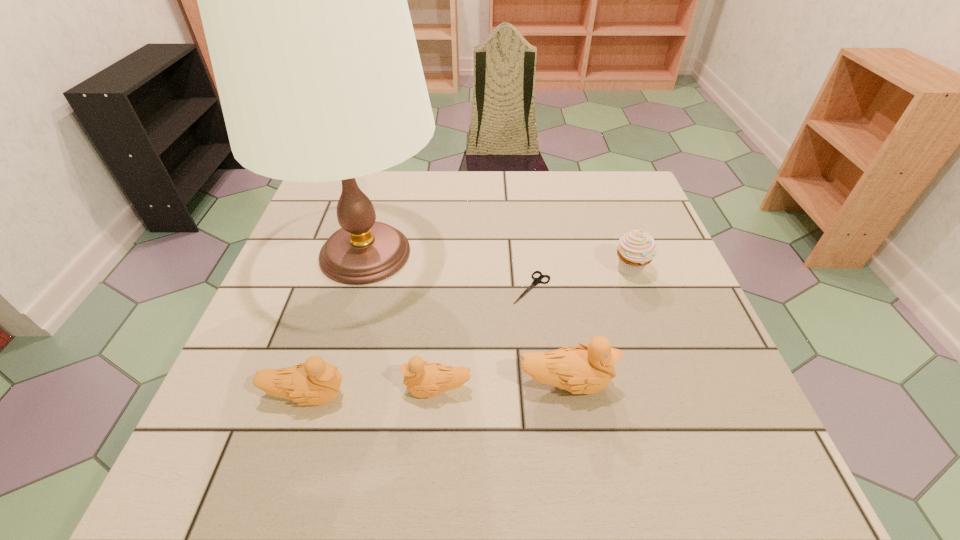
Identify the location of blank area located on the face of the fifth tallest object. The height and width of the screenshot is (540, 960). (258, 389).

Locate an element on the screen. Image resolution: width=960 pixels, height=540 pixels. vacant space situated 0.190m on the face of the rightmost duckling is located at coordinates (713, 383).

I want to click on free space located 0.120m on the front of the lamp, so click(336, 359).

This screenshot has width=960, height=540. Identify the location of free space located 0.380m on the left of the shortest object. (346, 288).

What are the coordinates of `free space located 0.270m on the left of the muffin` in the screenshot? It's located at (499, 270).

Where is `object located in the far edge section of the desktop`? This screenshot has width=960, height=540. object located in the far edge section of the desktop is located at coordinates (303, 0).

The image size is (960, 540). I want to click on duckling present at the left edge, so click(x=314, y=382).

The image size is (960, 540). I want to click on lamp that is at the left edge, so click(x=303, y=0).

I want to click on object that is at the right edge, so click(637, 248).

This screenshot has width=960, height=540. Find the location of `object that is at the far left corner`. object that is at the far left corner is located at coordinates (303, 0).